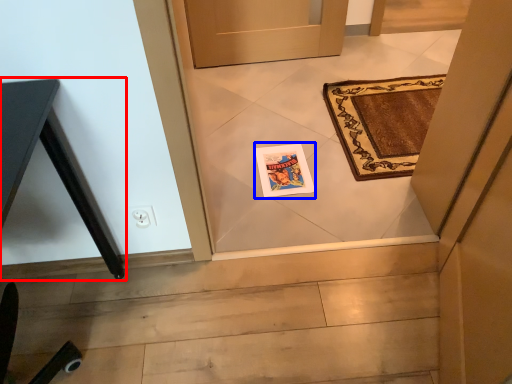
Question: Which object is closer to the camera taking this photo, table (highlighted by a red box) or postcard (highlighted by a blue box)?

Choices:
 (A) table
 (B) postcard

Answer: (A)